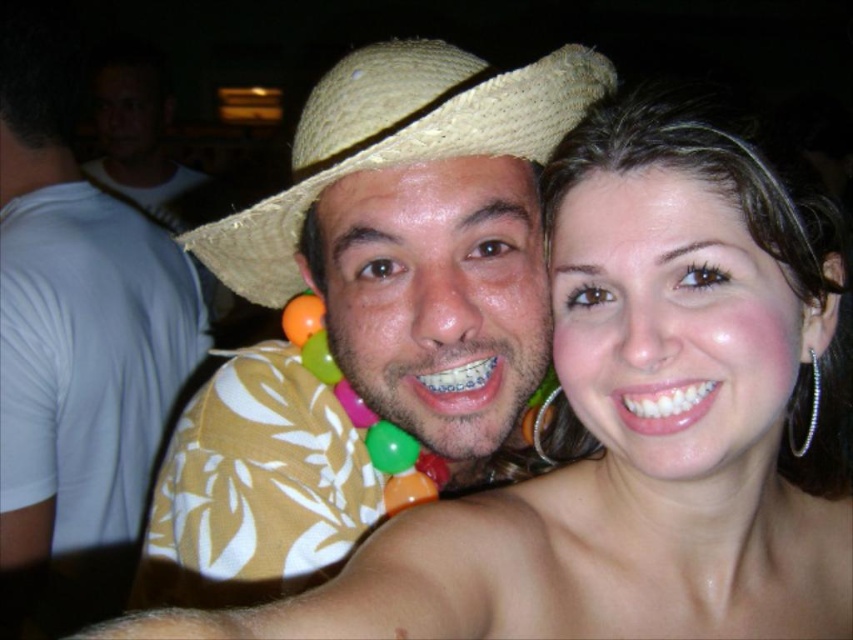
Question: Does strawmaterial/texturecowboy hat at upper center come in front of silver metallic hoop earring at right?

Choices:
 (A) no
 (B) yes

Answer: (B)

Question: Observing the image, what is the correct spatial positioning of strawmaterial/texturecowboy hat at upper center in reference to silver metallic hoop earring at right?

Choices:
 (A) above
 (B) below

Answer: (A)

Question: Can you confirm if strawmaterial/texturecowboy hat at upper center is positioned to the right of silver metallic hoop earring at right?

Choices:
 (A) no
 (B) yes

Answer: (A)